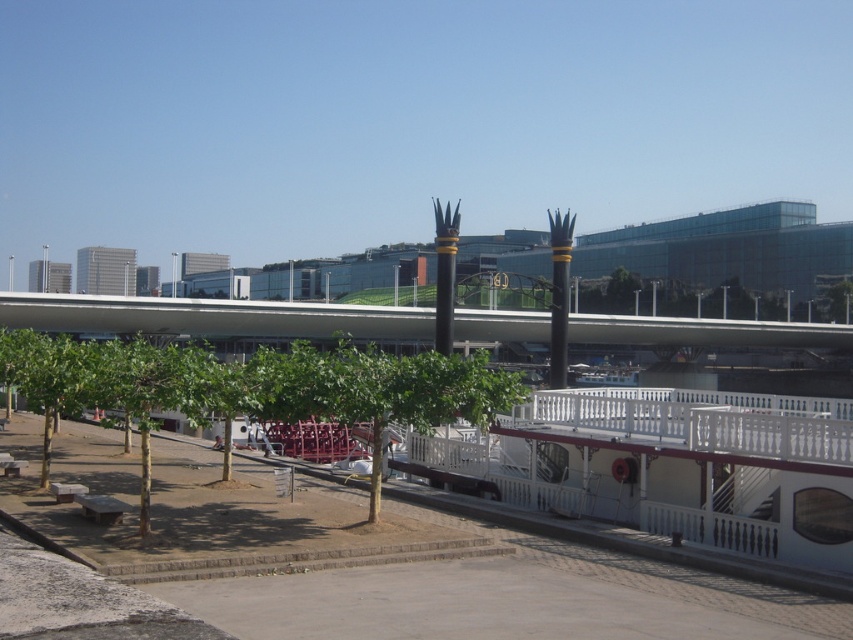
At what (x,y) coordinates should I click in order to perform the action: click on green leafy tree at lower left. Please return your answer as a coordinate pair (x, y). Looking at the image, I should click on (252, 387).

Which is more to the right, green leafy tree at lower left or green leafy tree at center?

green leafy tree at center is more to the right.

Who is more forward, [444,416] or [326,413]?

Positioned in front is point [444,416].

Image resolution: width=853 pixels, height=640 pixels. What are the coordinates of `green leafy tree at lower left` in the screenshot? It's located at (252, 387).